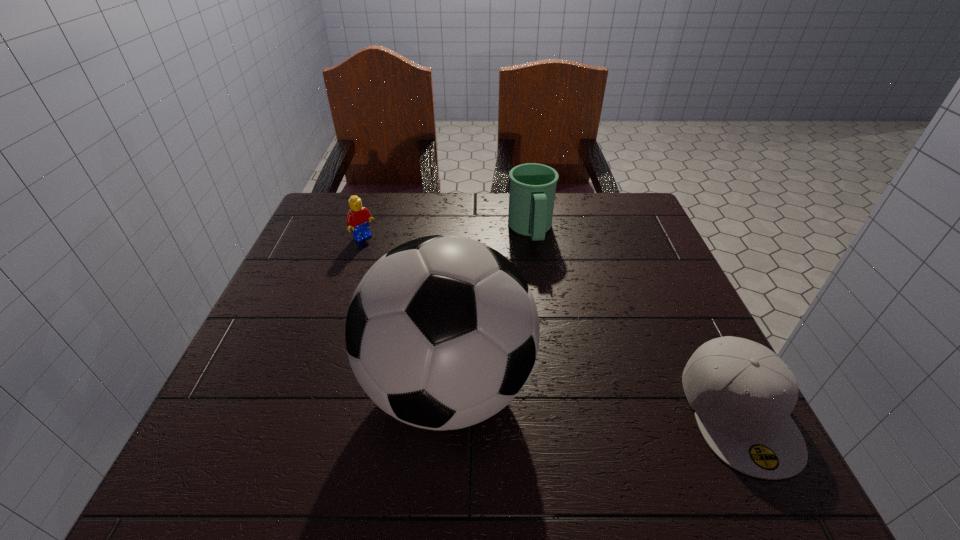
The height and width of the screenshot is (540, 960). What are the coordinates of `vacant space located on the side of the mug with the handle` in the screenshot? It's located at (557, 323).

Where is `vacant area situated on the side of the mug with the handle`? vacant area situated on the side of the mug with the handle is located at coordinates (540, 265).

I want to click on free spot located 0.230m on the side of the mug with the handle, so click(x=556, y=319).

Where is `Lego located at the far edge`? This screenshot has height=540, width=960. Lego located at the far edge is located at coordinates (358, 218).

The image size is (960, 540). Find the location of `mug present at the far edge`. mug present at the far edge is located at coordinates (532, 192).

This screenshot has width=960, height=540. In order to click on soccer ball that is at the near edge in this screenshot , I will do `click(442, 332)`.

Locate an element on the screen. cap present at the near edge is located at coordinates (742, 393).

Locate an element on the screen. The image size is (960, 540). object that is at the left edge is located at coordinates (358, 218).

This screenshot has width=960, height=540. I want to click on object at the right edge, so click(742, 393).

The image size is (960, 540). I want to click on object that is at the far left corner, so click(x=358, y=218).